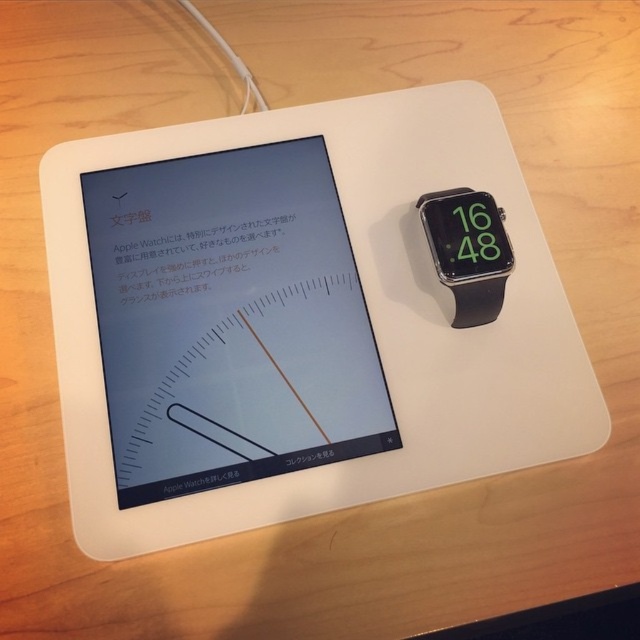
Question: Which point is closer to the camera?

Choices:
 (A) matte black tablet at left
 (B) black rubber watch at upper right

Answer: (A)

Question: Which of the following is the closest to the observer?

Choices:
 (A) matte black tablet at left
 (B) black rubber watch at upper right

Answer: (A)

Question: Can you confirm if matte black tablet at left is smaller than black rubber watch at upper right?

Choices:
 (A) no
 (B) yes

Answer: (A)

Question: Can you confirm if matte black tablet at left is positioned to the right of black rubber watch at upper right?

Choices:
 (A) yes
 (B) no

Answer: (B)

Question: Is matte black tablet at left thinner than black rubber watch at upper right?

Choices:
 (A) no
 (B) yes

Answer: (A)